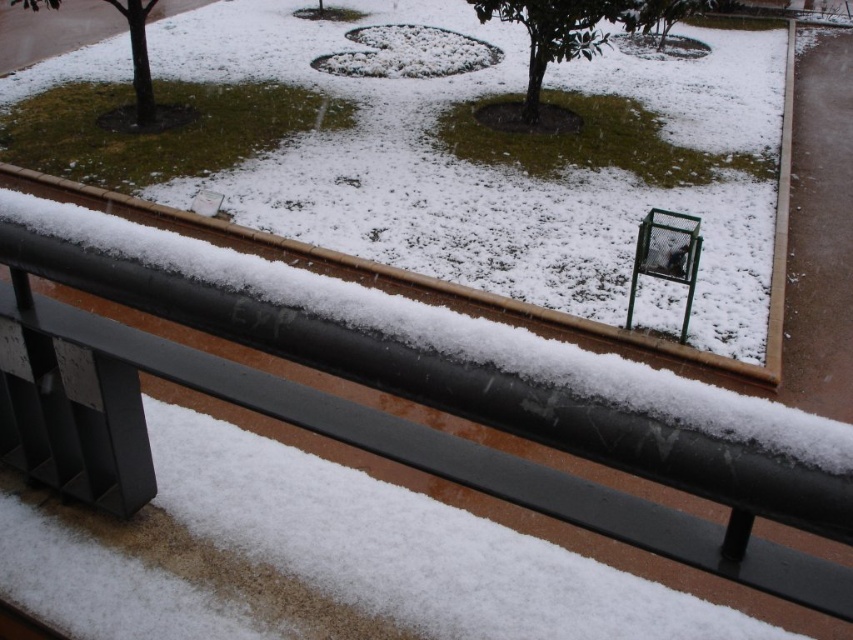
You are standing at the point marked as point (669, 26). You want to walk to the nearest tree in the landscaped area behind the railing. How far will you have to walk?

The distance between you and the nearest tree in the landscaped area behind the railing is 49.30 feet, so you will have to walk 49.30 feet to reach it.

You are a gardener planning to trim the green matte tree at center and the green matte tree at upper left. Which tree will require a shorter ladder to reach the top?

The green matte tree at center is shorter than the green matte tree at upper left, so you will need a shorter ladder for the green matte tree at center.

You are standing at the center of the walkway and see the green matte tree at center and the green matte tree at upper left. Which tree is closer to you?

The green matte tree at center is closer to you because it is smaller in size compared to the green matte tree at upper left. In perspective, objects that are closer appear larger, so the smaller size indicates it is farther away. Wait, that seems contradictory. Let me think again. If the tree at center is smaller but closer, that might not follow perspective rules. Maybe the description says the center tree is smaller, so if they are the same type, the smaller one is farther. Hmm, the answer needs to be re